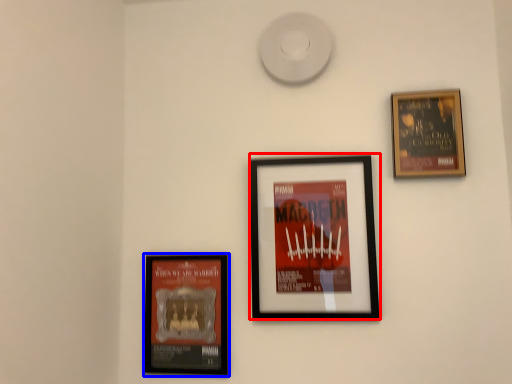
Question: Which object is further to the camera taking this photo, picture frame (highlighted by a red box) or picture frame (highlighted by a blue box)?

Choices:
 (A) picture frame
 (B) picture frame

Answer: (B)